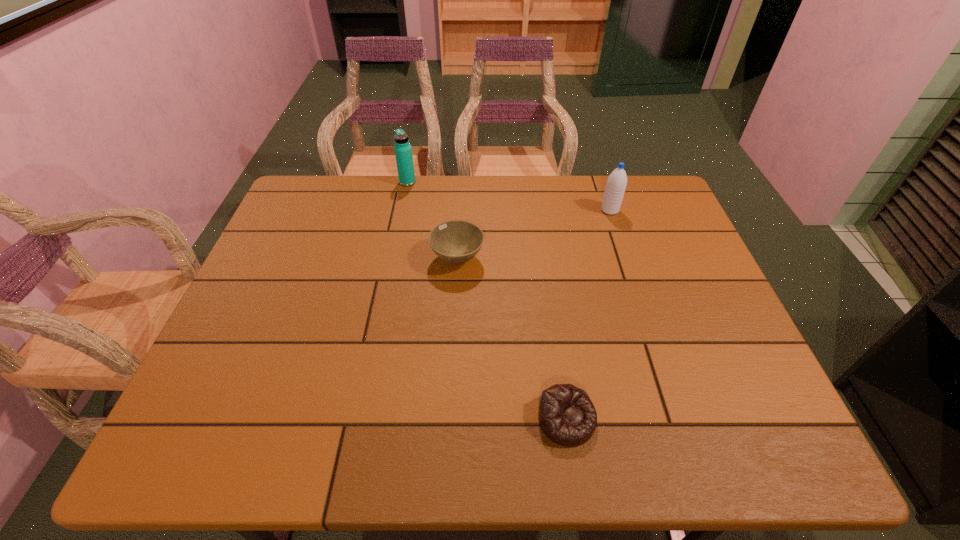
At what (x,y) coordinates should I click in order to perform the action: click on the left water bottle. Please return your answer as a coordinate pair (x, y). Looking at the image, I should click on (403, 151).

Identify the location of the farther water bottle. The image size is (960, 540). (403, 151).

Where is `the rightmost object`? the rightmost object is located at coordinates (616, 184).

At what (x,y) coordinates should I click in order to perform the action: click on the right water bottle. Please return your answer as a coordinate pair (x, y). The height and width of the screenshot is (540, 960). Looking at the image, I should click on (616, 184).

Where is `the third object from right to left`? the third object from right to left is located at coordinates (456, 241).

I want to click on the third farthest object, so click(456, 241).

Locate an element on the screen. This screenshot has width=960, height=540. the shortest object is located at coordinates click(567, 416).

Identify the location of the third object from left to right. This screenshot has width=960, height=540. (567, 416).

Identify the location of free point located 0.370m on the right of the leftmost object. The width and height of the screenshot is (960, 540). (526, 182).

The width and height of the screenshot is (960, 540). I want to click on vacant area located 0.330m on the left of the second farthest object, so click(x=494, y=210).